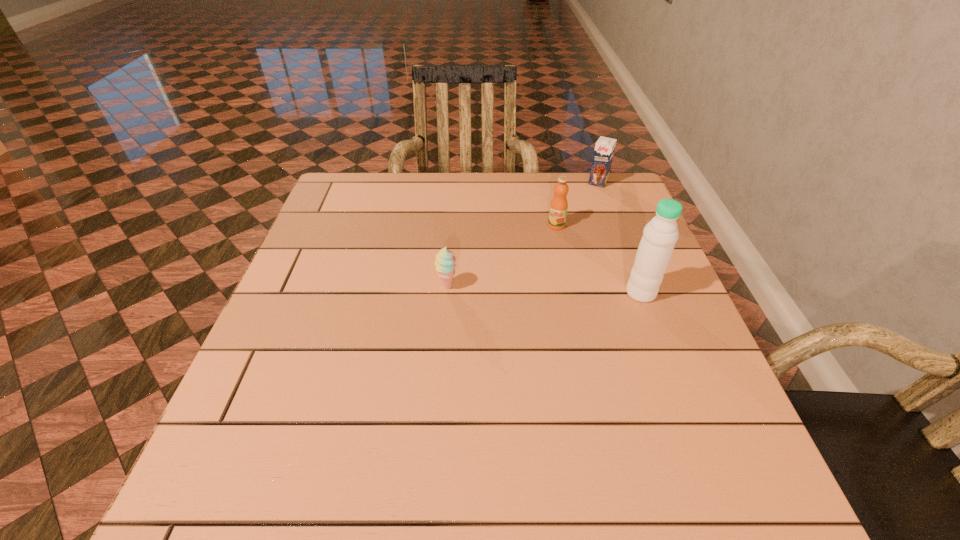
Locate an element on the screen. This screenshot has height=540, width=960. the leftmost object is located at coordinates (445, 264).

This screenshot has width=960, height=540. Identify the location of the shortest object. (445, 264).

Image resolution: width=960 pixels, height=540 pixels. I want to click on water bottle, so click(x=659, y=237).

Identify the location of the third object from right to left. This screenshot has height=540, width=960. (558, 207).

The width and height of the screenshot is (960, 540). Identify the location of orange juice. (558, 207).

This screenshot has height=540, width=960. In order to click on chocolate milk in this screenshot , I will do [x=604, y=149].

I want to click on blank area located 0.110m on the left of the shortest object, so click(389, 286).

In order to click on free region located 0.080m on the left of the water bottle in this screenshot , I will do `click(590, 293)`.

Image resolution: width=960 pixels, height=540 pixels. In order to click on vacant space located 0.050m on the front label of the second object from left to right in this screenshot , I will do `click(546, 240)`.

The image size is (960, 540). I want to click on vacant space located 0.350m on the front label of the second object from left to right, so click(x=495, y=317).